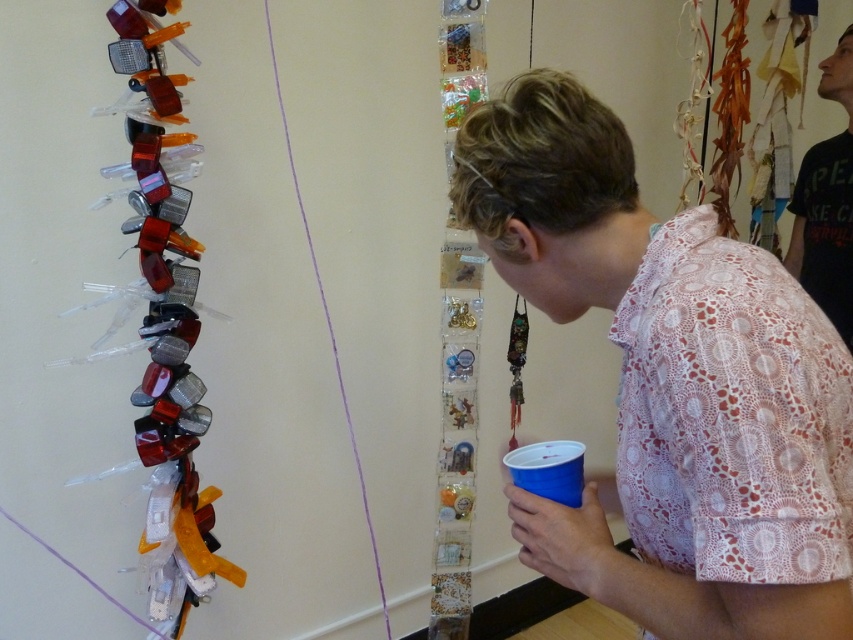
Which is in front, point (521, 506) or point (839, 157)?

Positioned in front is point (521, 506).

Does pink lace shirt at center have a smaller size compared to black cotton shirt at upper right?

Yes, pink lace shirt at center is smaller than black cotton shirt at upper right.

Who is more forward, (x=659, y=408) or (x=834, y=244)?

Positioned in front is point (x=659, y=408).

Locate an element on the screen. The width and height of the screenshot is (853, 640). pink lace shirt at center is located at coordinates (671, 381).